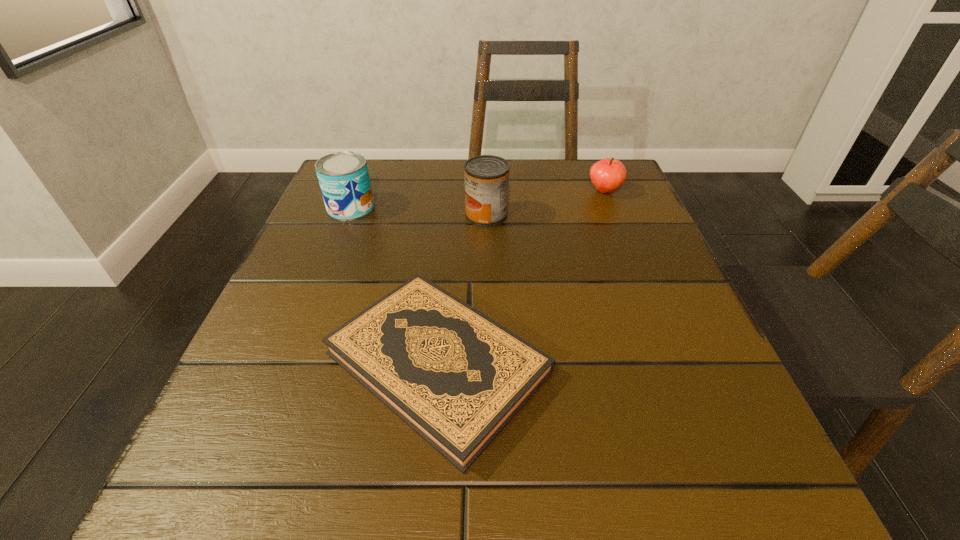
Find the location of a particular element. The image size is (960, 540). free space between the nearest object and the leftmost object is located at coordinates (395, 285).

At what (x,y) coordinates should I click in order to perform the action: click on unoccupied position between the apple and the right can. Please return your answer as a coordinate pair (x, y). The width and height of the screenshot is (960, 540). Looking at the image, I should click on (545, 203).

Locate which object is the closest to the right can. Please provide its 2D coordinates. Your answer should be formatted as a tuple, i.e. [(x, y)], where the tuple contains the x and y coordinates of a point satisfying the conditions above.

[(455, 376)]

Identify which object is located as the second nearest to the leftmost object. Please provide its 2D coordinates. Your answer should be formatted as a tuple, i.e. [(x, y)], where the tuple contains the x and y coordinates of a point satisfying the conditions above.

[(455, 376)]

Find the location of a particular element. This screenshot has height=540, width=960. free location that satisfies the following two spatial constraints: 1. on the back side of the shortest object; 2. on the right side of the right can is located at coordinates point(451,215).

Locate an element on the screen. Image resolution: width=960 pixels, height=540 pixels. vacant position in the image that satisfies the following two spatial constraints: 1. on the front side of the left can; 2. on the left side of the right can is located at coordinates (348, 215).

Identify the location of free space that satisfies the following two spatial constraints: 1. on the back side of the left can; 2. on the right side of the apple. (357, 191).